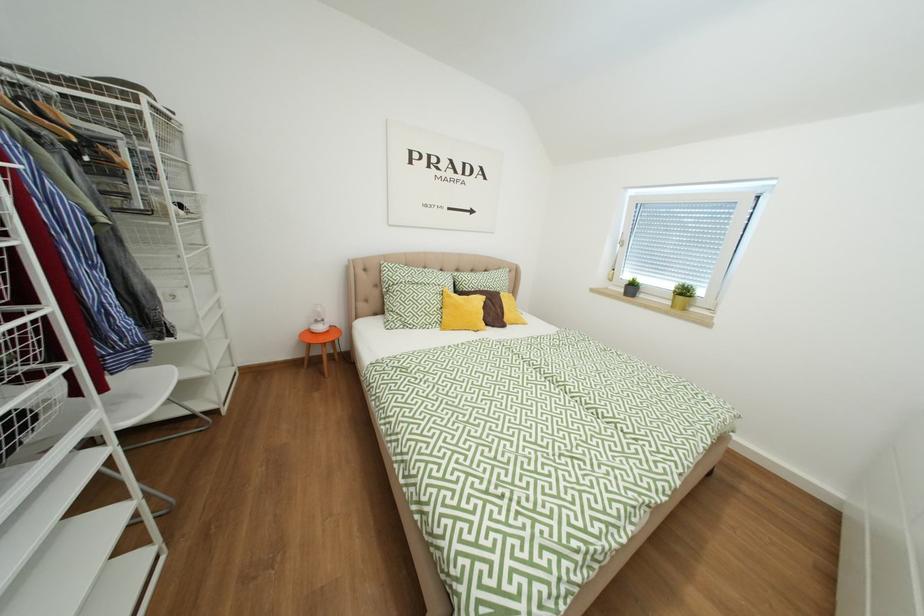
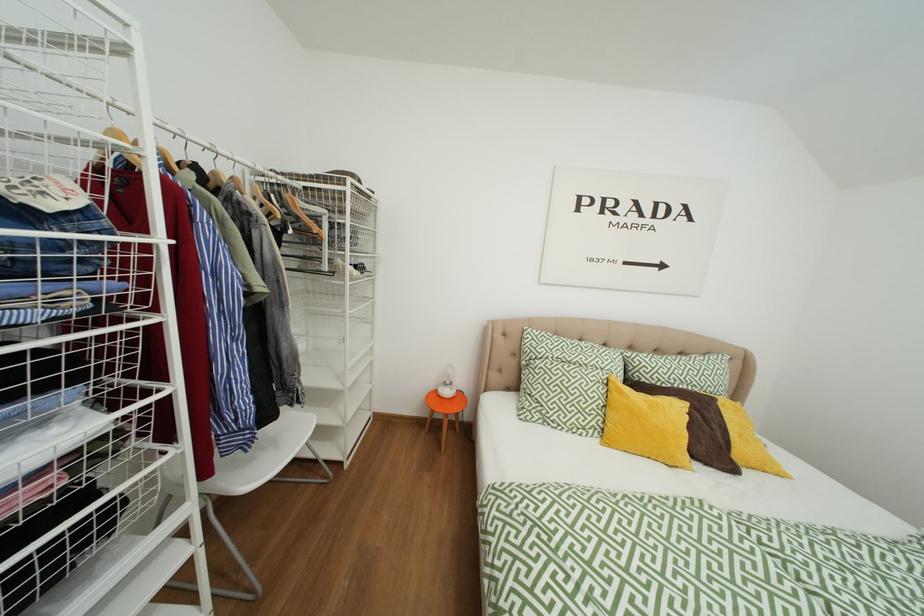
Question: The images are taken continuously from a first-person perspective. In which direction is your viewpoint rotating?

Choices:
 (A) Left
 (B) Right
 (C) Up
 (D) Down

Answer: (A)